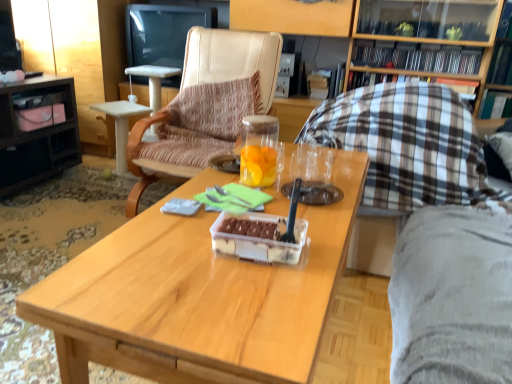
Question: Is transparent glass jar at center taller or shorter than beige leather chair at center, which is the 2th chair from right to left?

Choices:
 (A) tall
 (B) short

Answer: (B)

Question: From a real-world perspective, relative to beige leather chair at center, the first chair in the left-to-right sequence, is transparent glass jar at center vertically above or below?

Choices:
 (A) below
 (B) above

Answer: (B)

Question: Which of these objects is positioned farthest from the plaid fabric pillow at upper right, acting as the 3th book starting from the back?

Choices:
 (A) matte black desk at left
 (B) black glossy television at upper center
 (C) black plastic books at upper right, which appears as the second book when viewed from the back
 (D) transparent glass jar at center
 (E) hardcover book at center, the first book positioned from the back

Answer: (A)

Question: Estimate the real-world distances between objects in this image. Which object is farther from the plaid fabric chair at right, the first chair in the right-to-left sequence?

Choices:
 (A) black plastic books at upper right, which appears as the second book when viewed from the back
 (B) wooden coffee table at center
 (C) matte black desk at left
 (D) beige leather chair at center, the first chair in the left-to-right sequence
 (E) plaid fabric pillow at upper right, which appears as the 1th book when viewed from the front

Answer: (C)